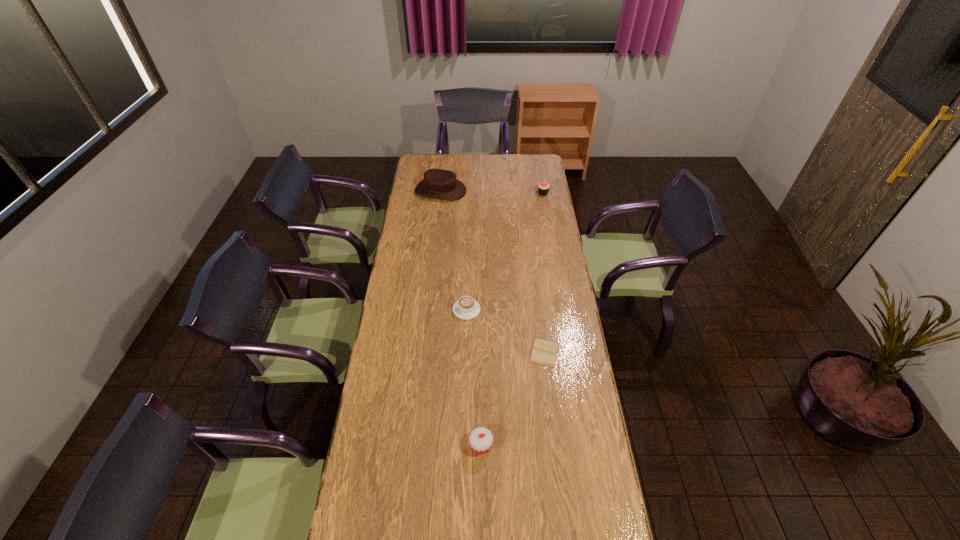
This screenshot has height=540, width=960. Find the location of `hat`. hat is located at coordinates (438, 183).

Locate an element on the screen. The height and width of the screenshot is (540, 960). the farther cupcake is located at coordinates (543, 187).

The width and height of the screenshot is (960, 540). I want to click on the nearest object, so click(481, 439).

In order to click on the left cupcake in this screenshot , I will do `click(481, 439)`.

This screenshot has width=960, height=540. I want to click on the third farthest object, so 466,308.

This screenshot has width=960, height=540. Find the location of `cappuccino`. cappuccino is located at coordinates (466, 308).

Find the location of `the fourth farthest object`. the fourth farthest object is located at coordinates (544, 352).

This screenshot has width=960, height=540. I want to click on diary, so click(544, 352).

Find the location of a particular element. vacant space located 0.220m on the front of the tallest object is located at coordinates (437, 227).

Identify the location of vacant area situated on the back of the right cupcake. This screenshot has height=540, width=960. [538, 160].